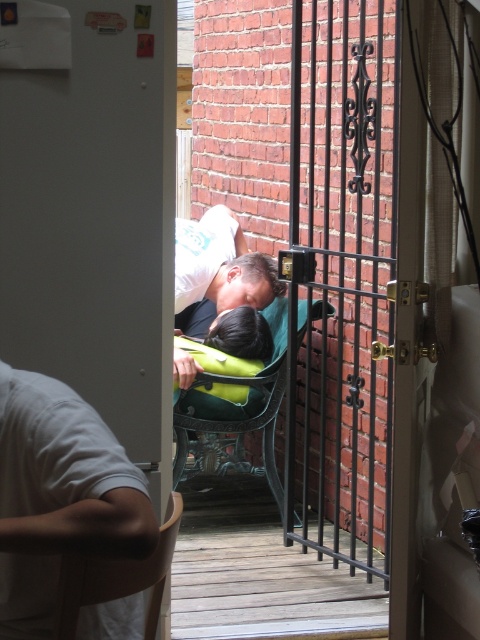
Is point (133, 428) in front of point (282, 326)?

Yes, it is in front of point (282, 326).

Which is below, white matte door at upper left or green plastic chair at center?

Positioned lower is green plastic chair at center.

Measure the distance between white matte door at upper left and camera.

2.50 meters

Where is `white matte door at upper left`? The height and width of the screenshot is (640, 480). white matte door at upper left is located at coordinates (96, 221).

Who is shorter, white cotton shirt at lower left or matte green backpack at center?

white cotton shirt at lower left

Can you confirm if white cotton shirt at lower left is thinner than matte green backpack at center?

Yes.

Identify the location of white cotton shirt at lower left. (59, 496).

In the scene shown: Between white matte door at upper left and white cotton shirt at lower left, which one has less height?

white cotton shirt at lower left

Can you confirm if white matte door at upper left is wider than white cotton shirt at lower left?

Indeed, white matte door at upper left has a greater width compared to white cotton shirt at lower left.

The width and height of the screenshot is (480, 640). What are the coordinates of `white matte door at upper left` in the screenshot? It's located at (96, 221).